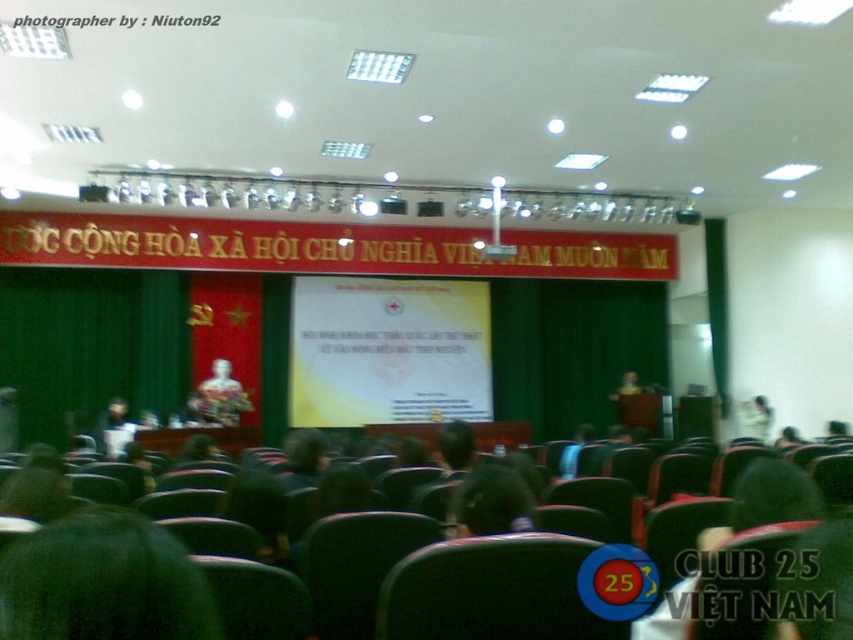
Does matte gold statue at center appear on the left side of matte white shirt at center?

Indeed, matte gold statue at center is positioned on the left side of matte white shirt at center.

Measure the distance between matte gold statue at center and camera.

They are 32.69 feet apart.

The height and width of the screenshot is (640, 853). I want to click on matte gold statue at center, so click(x=223, y=396).

Does yellow matte projection screen at center appear on the right side of dark green leaf at lower left?

In fact, yellow matte projection screen at center is to the left of dark green leaf at lower left.

You are a GUI agent. You are given a task and a screenshot of the screen. Output one action in this format:
    pyautogui.click(x=<x>, y=<y>)
    Task: Click on the yellow matte projection screen at center
    
    Given the screenshot: What is the action you would take?
    pyautogui.click(x=387, y=352)

Who is shorter, dark green leaf at lower left or matte white shirt at center?

With less height is dark green leaf at lower left.

Who is more distant from viewer, [25,576] or [750,419]?

The point [750,419] is more distant.

This screenshot has height=640, width=853. I want to click on dark green leaf at lower left, so click(x=103, y=582).